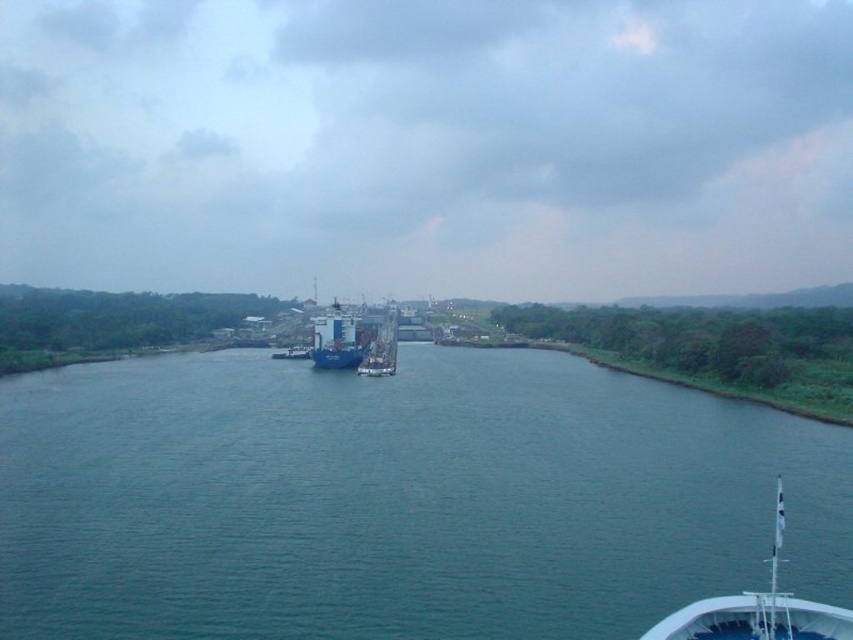
Question: Among these objects, which one is farthest from the camera?

Choices:
 (A) blue matte container ship at center
 (B) blue water at center

Answer: (A)

Question: Considering the relative positions of blue water at center and white glossy boat at lower right in the image provided, where is blue water at center located with respect to white glossy boat at lower right?

Choices:
 (A) below
 (B) above

Answer: (B)

Question: Can you confirm if blue water at center is wider than blue matte container ship at center?

Choices:
 (A) yes
 (B) no

Answer: (A)

Question: Which of the following is the farthest from the observer?

Choices:
 (A) (753, 595)
 (B) (347, 353)

Answer: (B)

Question: Estimate the real-world distances between objects in this image. Which object is closer to the blue water at center?

Choices:
 (A) white glossy boat at lower right
 (B) blue matte container ship at center

Answer: (A)

Question: Where is blue water at center located in relation to white glossy boat at lower right in the image?

Choices:
 (A) right
 (B) left

Answer: (B)